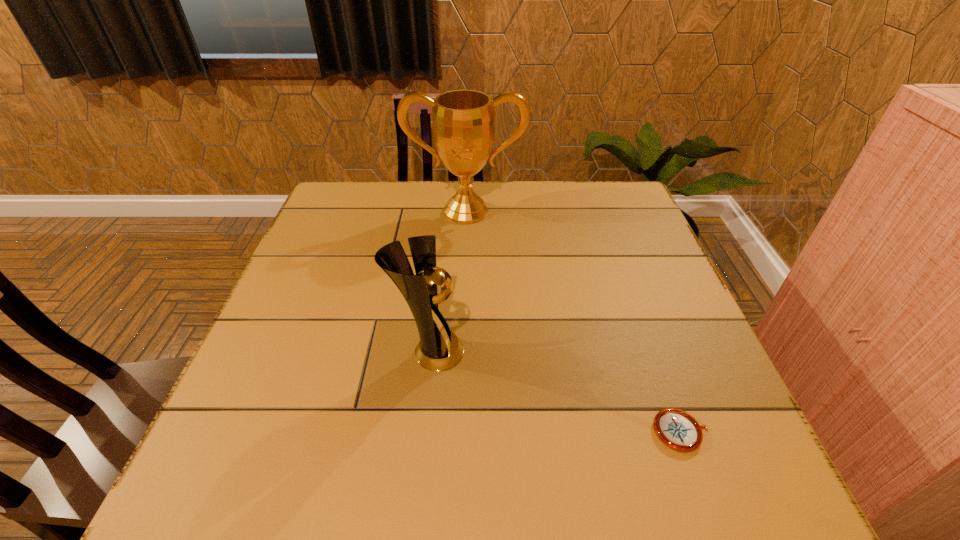
Find the location of a particular element. The width and height of the screenshot is (960, 540). blank area in the image that satisfies the following two spatial constraints: 1. on the back side of the compass; 2. at the front of the second nearest object, where the globe is visible is located at coordinates coord(652,352).

In order to click on blank area in the image that satisfies the following two spatial constraints: 1. at the front of the second nearest object, where the globe is visible; 2. on the left side of the compass in this screenshot , I will do `click(421, 431)`.

Where is `free space in the image that satisfies the following two spatial constraints: 1. on the front-facing side of the tallest object; 2. on the left side of the rightmost object`? free space in the image that satisfies the following two spatial constraints: 1. on the front-facing side of the tallest object; 2. on the left side of the rightmost object is located at coordinates [457, 431].

Identify the location of free space that satisfies the following two spatial constraints: 1. at the front of the rightmost object, where the globe is visible; 2. on the right side of the second shortest object. The image size is (960, 540). (x=421, y=431).

You are a GUI agent. You are given a task and a screenshot of the screen. Output one action in this format:
    pyautogui.click(x=<x>, y=<y>)
    Task: Click on the vacant position in the image that satisfies the following two spatial constraints: 1. at the front of the compass, where the globe is visible; 2. on the left side of the nearer award
    
    Given the screenshot: What is the action you would take?
    pyautogui.click(x=421, y=431)

Where is `free space in the image that satisfies the following two spatial constraints: 1. on the back side of the compass; 2. at the front of the second farthest object, where the globe is visible`? The height and width of the screenshot is (540, 960). free space in the image that satisfies the following two spatial constraints: 1. on the back side of the compass; 2. at the front of the second farthest object, where the globe is visible is located at coordinates (652, 352).